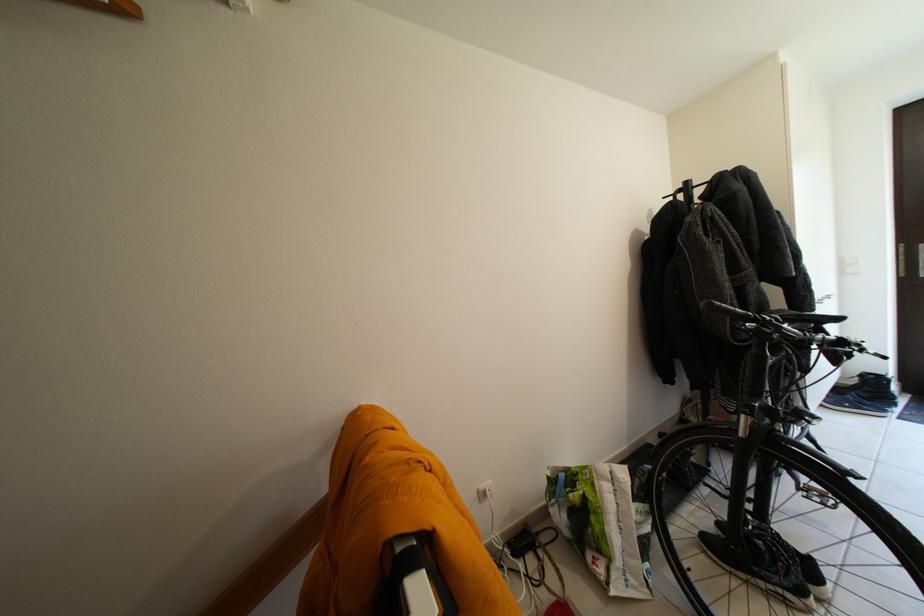
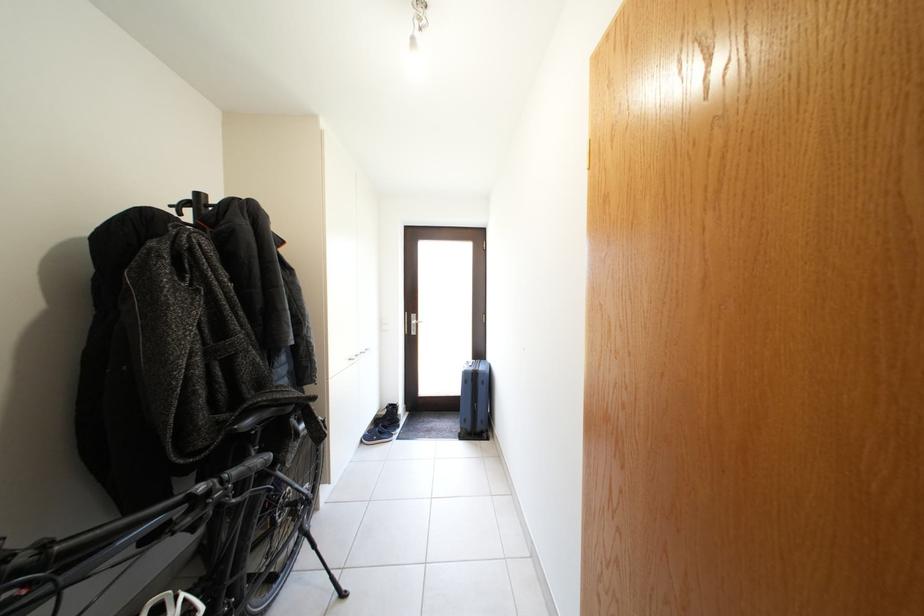
Find the pixel in the second image that matches [869,400] in the first image.

(392, 431)